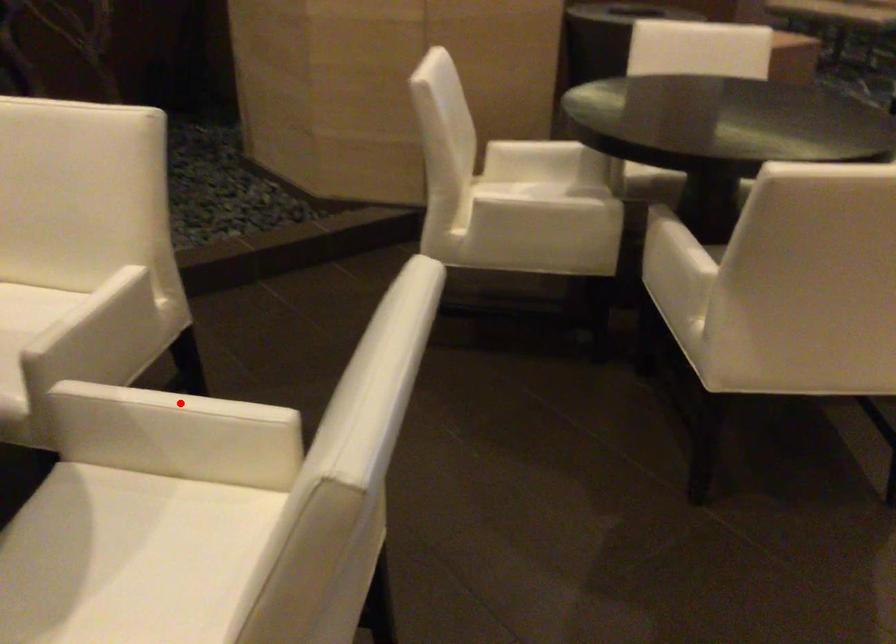
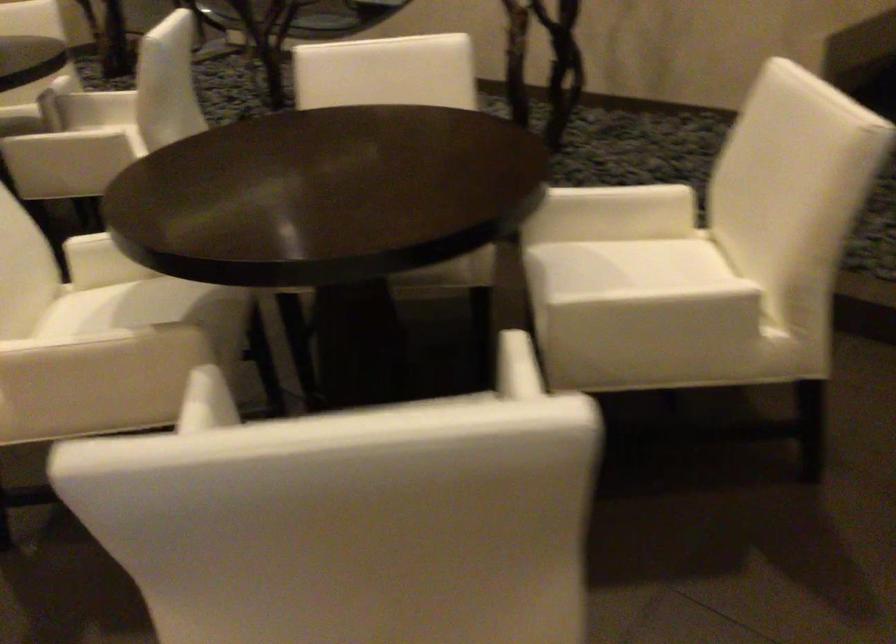
Question: I am providing you with two images of the same scene from different viewpoints. A red point is marked on the first image. Can you still see the location of the red point in image 2?

Choices:
 (A) Yes
 (B) No

Answer: (B)